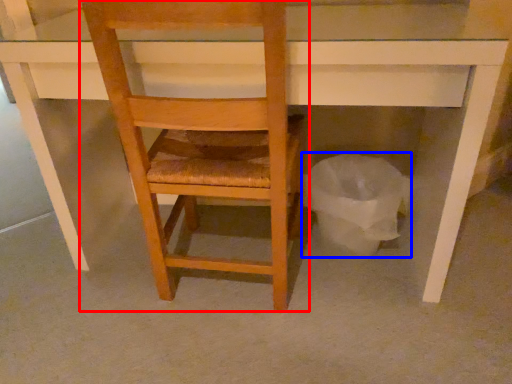
Question: Among these objects, which one is nearest to the camera, chair (highlighted by a red box) or garbage (highlighted by a blue box)?

Choices:
 (A) chair
 (B) garbage

Answer: (A)